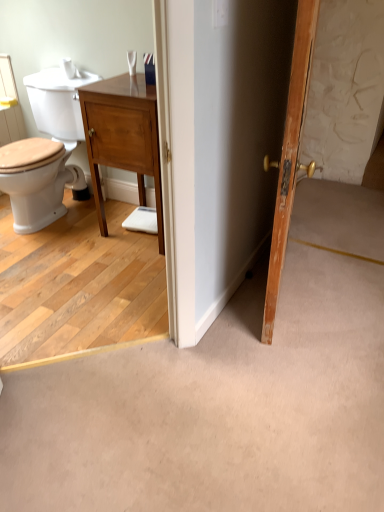
Question: Relative to wooden door at right, is light brown wood vanity at center in front or behind?

Choices:
 (A) front
 (B) behind

Answer: (B)

Question: Visually, is light brown wood vanity at center positioned to the left or to the right of wooden door at right?

Choices:
 (A) left
 (B) right

Answer: (A)

Question: From a real-world perspective, is light brown wood vanity at center above or below wooden door at right?

Choices:
 (A) below
 (B) above

Answer: (A)

Question: Is wooden door at right inside the boundaries of light brown wood vanity at center, or outside?

Choices:
 (A) inside
 (B) outside

Answer: (B)

Question: From the image's perspective, is wooden door at right located above or below light brown wood vanity at center?

Choices:
 (A) above
 (B) below

Answer: (B)

Question: Is point (291, 177) closer or farther from the camera than point (125, 134)?

Choices:
 (A) closer
 (B) farther

Answer: (A)

Question: Is wooden door at right wider or thinner than light brown wood vanity at center?

Choices:
 (A) thin
 (B) wide

Answer: (A)